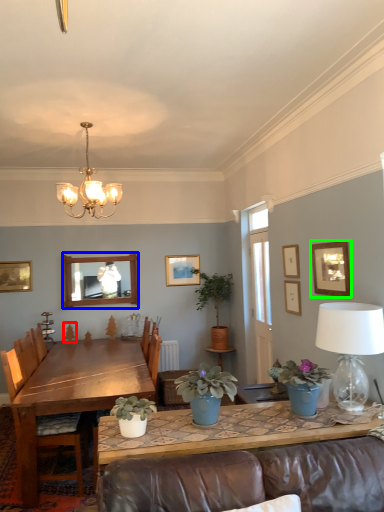
Question: Which object is the closest to the plant (highlighted by a red box)? Choose among these: mirror (highlighted by a blue box) or picture frame (highlighted by a green box).

Choices:
 (A) mirror
 (B) picture frame

Answer: (A)